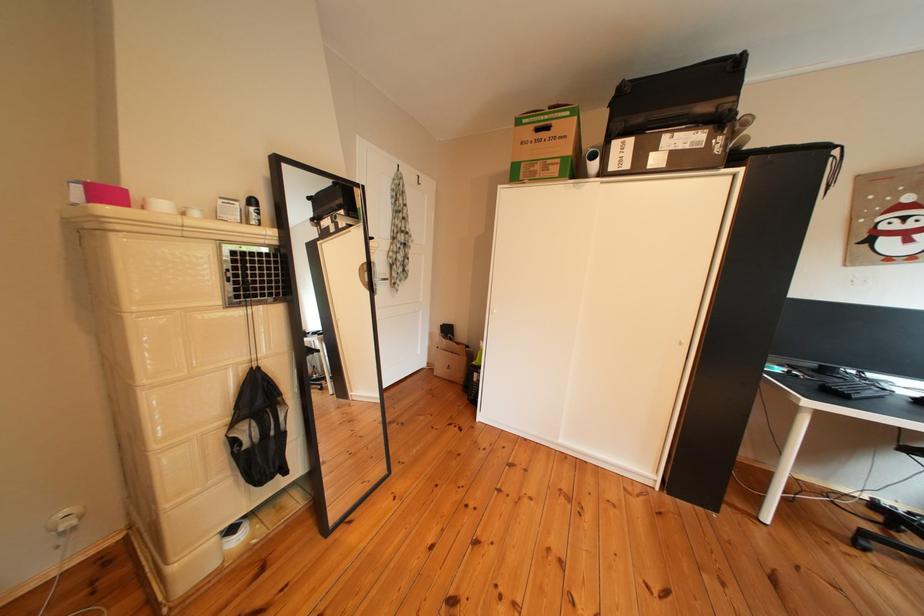
Image resolution: width=924 pixels, height=616 pixels. Describe the element at coordinates (105, 193) in the screenshot. I see `the pink box` at that location.